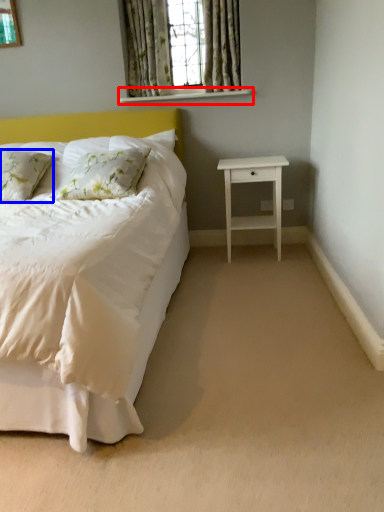
Question: Among these objects, which one is farthest to the camera, window sill (highlighted by a red box) or pillow (highlighted by a blue box)?

Choices:
 (A) window sill
 (B) pillow

Answer: (A)